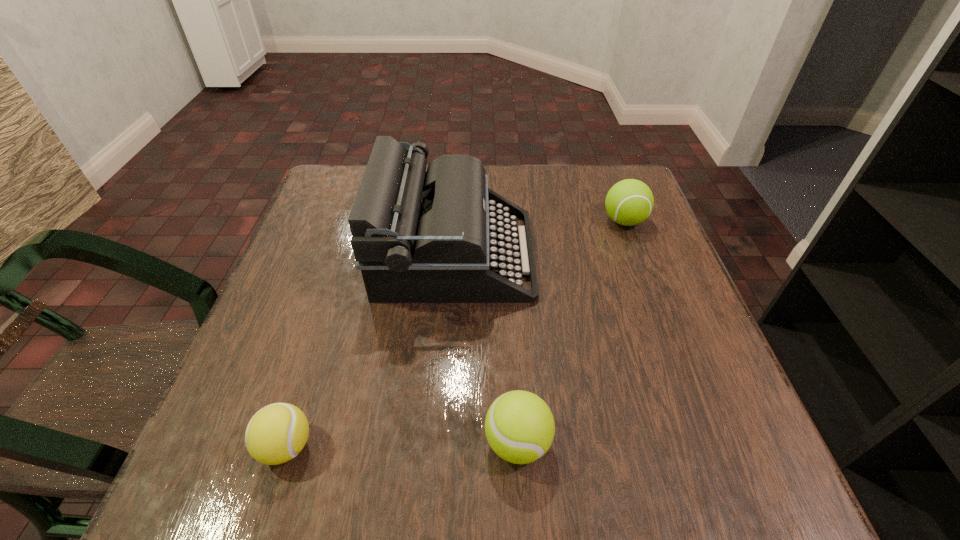
The height and width of the screenshot is (540, 960). I want to click on free space that satisfies the following two spatial constraints: 1. on the typing side of the typewriter; 2. on the front side of the leftmost tennis ball, so click(x=444, y=446).

Where is `free spot that satisfies the following two spatial constraints: 1. on the typing side of the second tennis ball from right to left; 2. on the right side of the typewriter`? free spot that satisfies the following two spatial constraints: 1. on the typing side of the second tennis ball from right to left; 2. on the right side of the typewriter is located at coordinates (444, 442).

Locate an element on the screen. vacant region that satisfies the following two spatial constraints: 1. on the back side of the second tennis ball from left to right; 2. on the right side of the farthest tennis ball is located at coordinates pyautogui.click(x=504, y=221).

This screenshot has width=960, height=540. I want to click on vacant area in the image that satisfies the following two spatial constraints: 1. on the typing side of the typewriter; 2. on the back side of the second tennis ball from right to left, so click(x=444, y=442).